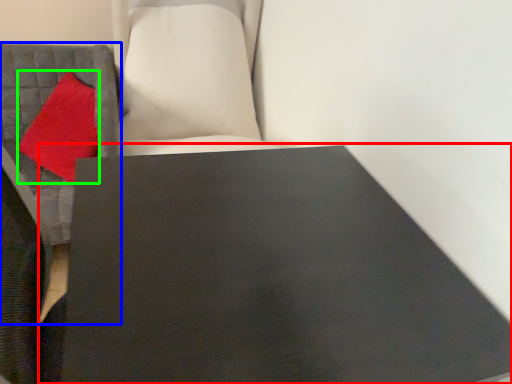
Question: Which object is the farthest from table (highlighted by a red box)? Choose among these: furniture (highlighted by a blue box) or throw pillow (highlighted by a green box).

Choices:
 (A) furniture
 (B) throw pillow

Answer: (B)